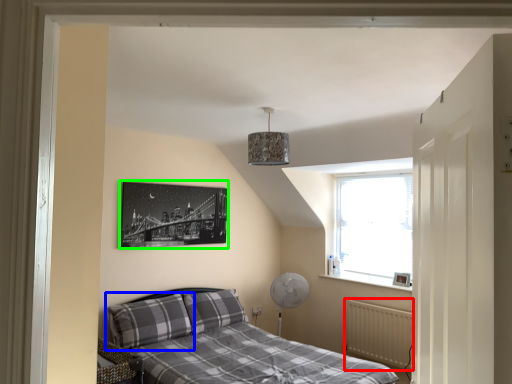
Question: Which object is the closest to the radiator (highlighted by a red box)? Choose among these: pillow (highlighted by a blue box) or picture frame (highlighted by a green box).

Choices:
 (A) pillow
 (B) picture frame

Answer: (A)